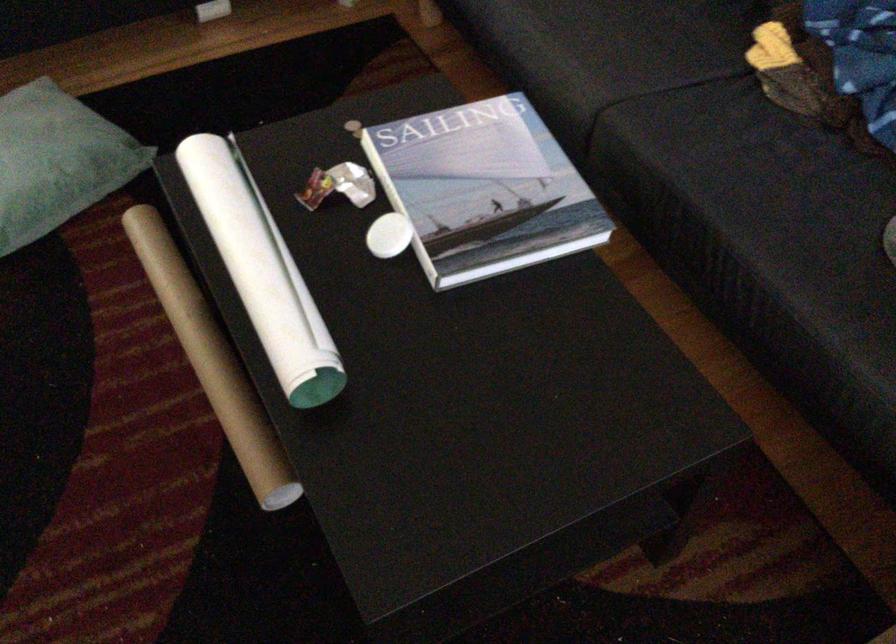
Which object does [262,270] point to?

It corresponds to the rolled up paper in the image.